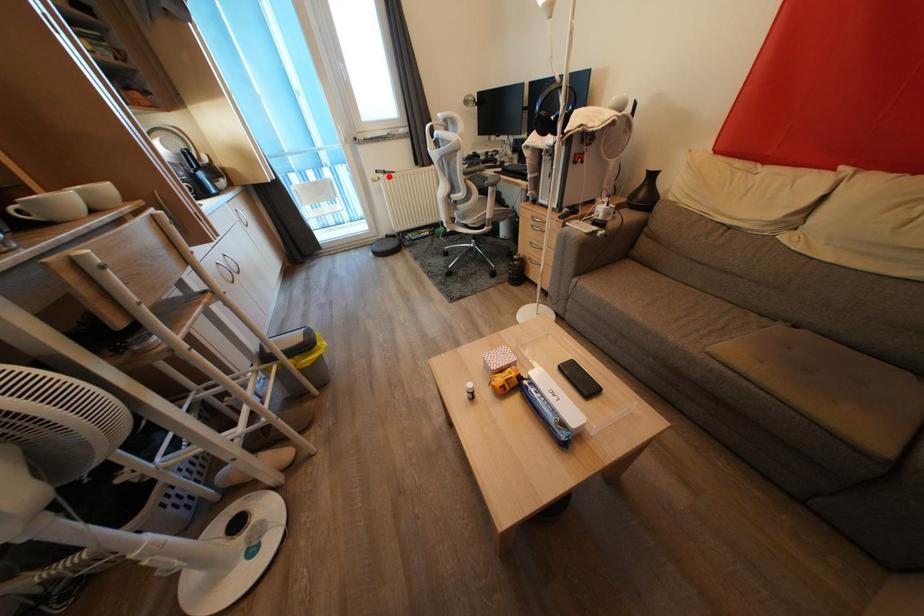
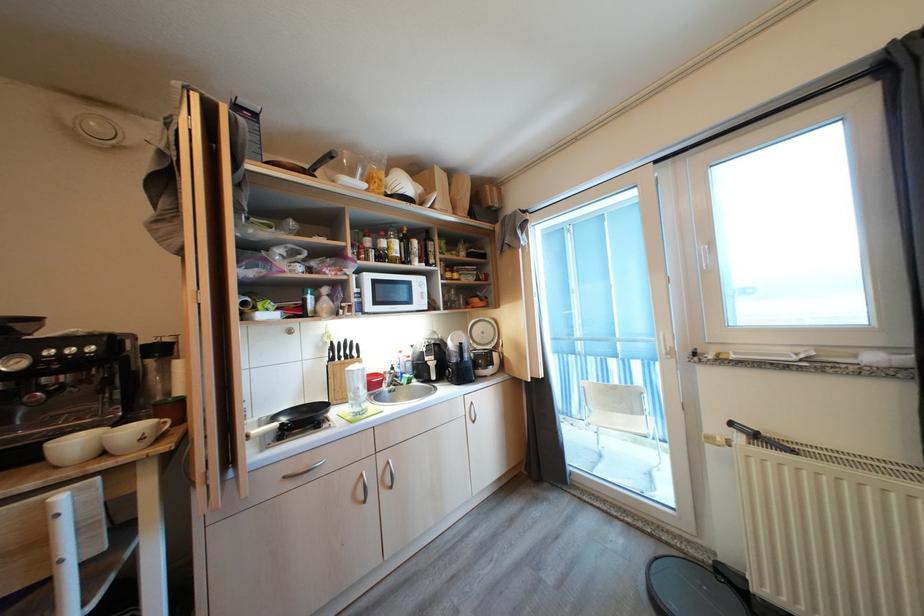
In the second image, find the point that corresponds to the highlighted location in the first image.

(760, 440)